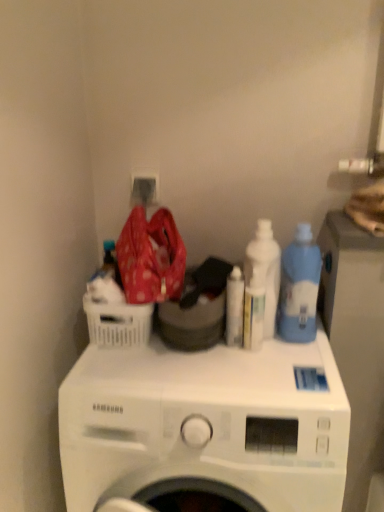
Question: From their relative heights in the image, would you say white plastic basket at left is taller or shorter than white glossy bottle at center, the 1th cleaning product when ordered from left to right?

Choices:
 (A) tall
 (B) short

Answer: (B)

Question: From a real-world perspective, is white plastic basket at left physically located above or below white glossy bottle at center, which is the third cleaning product from right to left?

Choices:
 (A) above
 (B) below

Answer: (A)

Question: Which of these objects is positioned closest to the white plastic bottle at center?

Choices:
 (A) white plastic basket at left
 (B) white glossy bottle at center, the 1th cleaning product when ordered from left to right
 (C) blue translucent bottle at right, placed as the first cleaning product when sorted from right to left
 (D) white glossy bottle at upper right, which appears as the second cleaning product when viewed from the right
 (E) white matte washing machine at center

Answer: (B)

Question: Estimate the real-world distances between objects in this image. Which object is farther from the white glossy bottle at upper right, positioned as the second cleaning product in left-to-right order?

Choices:
 (A) white plastic bottle at center
 (B) white glossy bottle at center, the 1th cleaning product when ordered from left to right
 (C) white matte washing machine at center
 (D) blue translucent bottle at right, placed as the third cleaning product when sorted from left to right
 (E) white plastic basket at left

Answer: (E)